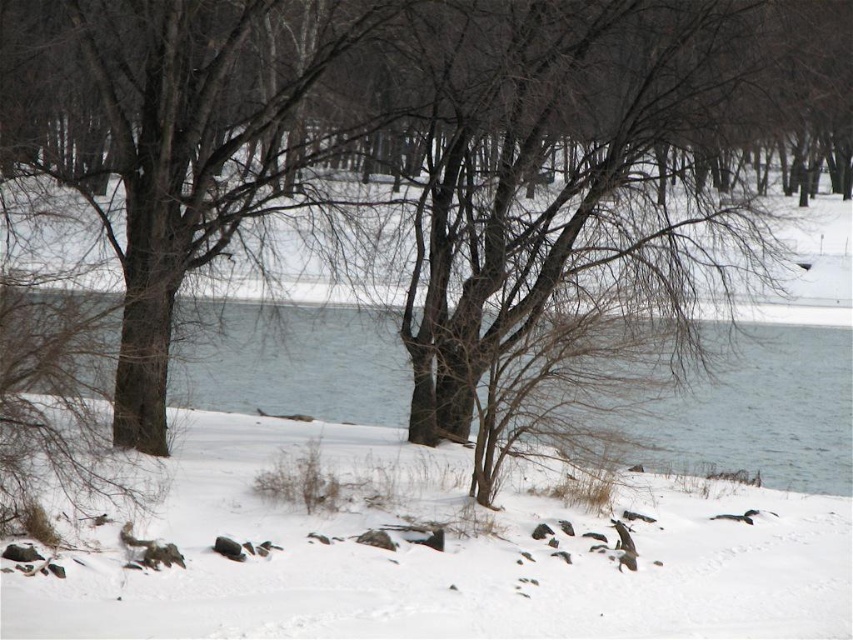
Does white fluffy snow at center appear under clear water at center?

Correct, white fluffy snow at center is located below clear water at center.

Does white fluffy snow at center have a lesser width compared to clear water at center?

Yes.

Does point (259, 632) come in front of point (790, 481)?

Yes, point (259, 632) is closer to viewer.

The image size is (853, 640). Identify the location of white fluffy snow at center. click(x=444, y=563).